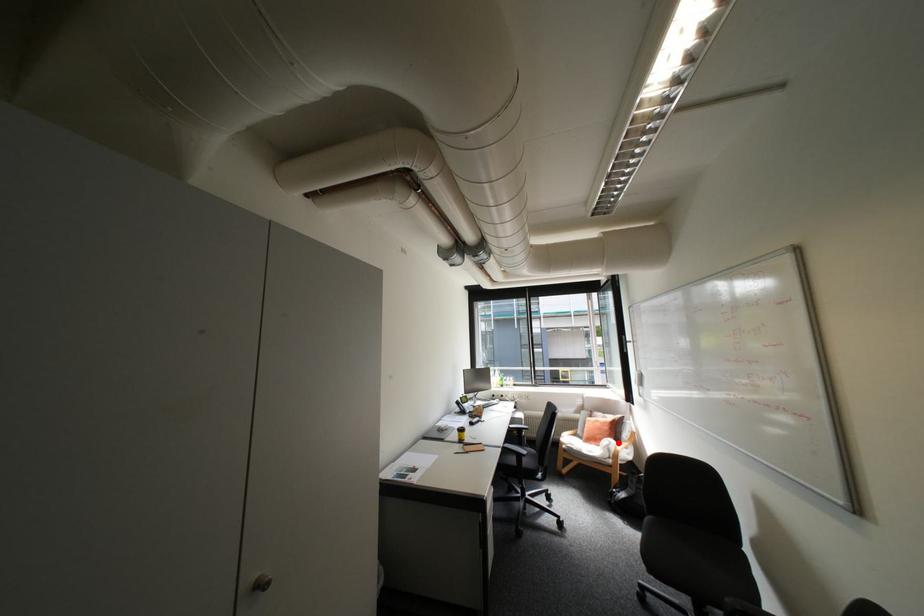
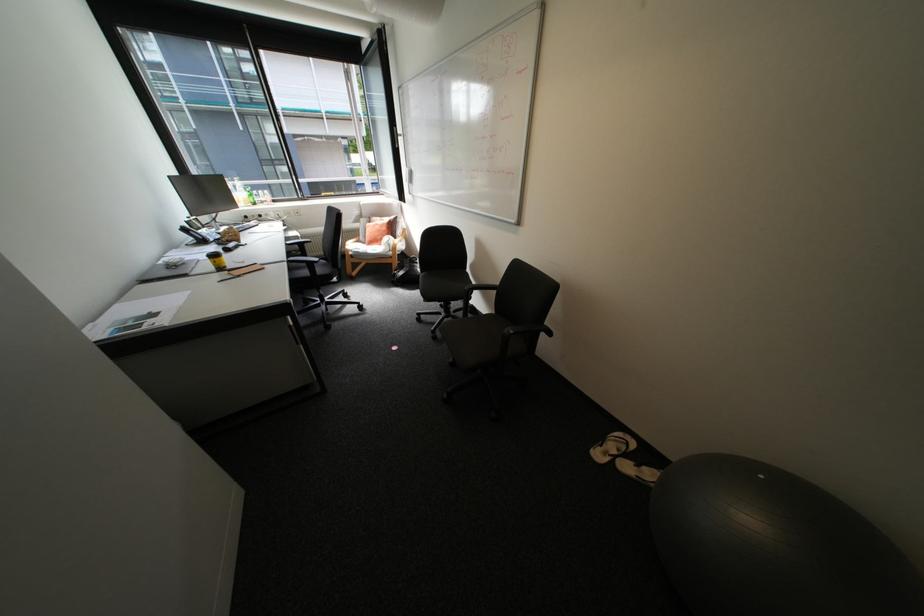
In the second image, find the point that corresponds to the highlighted location in the first image.

(397, 238)